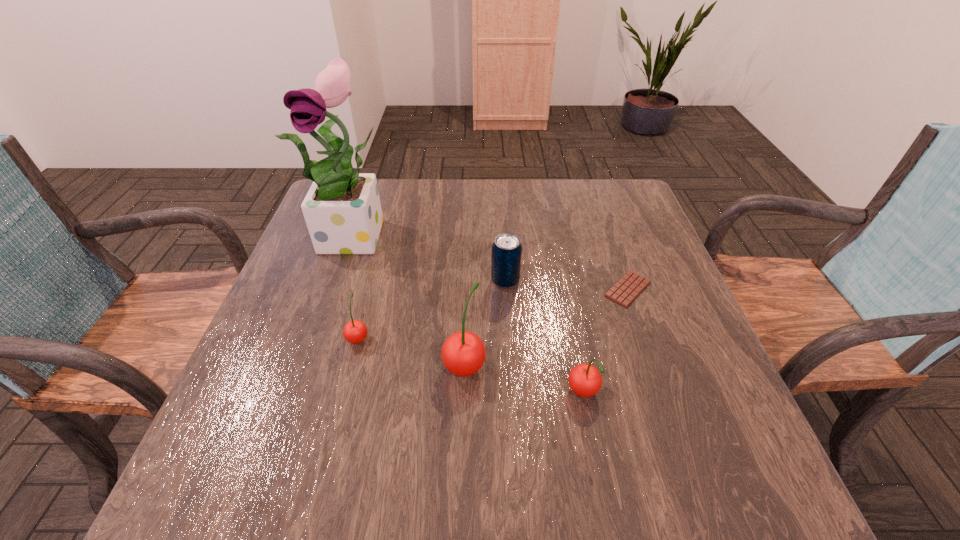
Where is `the rightmost object`? the rightmost object is located at coordinates (624, 292).

Identify the location of vacant space located 0.130m on the left of the second shortest object. This screenshot has height=540, width=960. (284, 338).

Find the location of `vacant space positioned on the right of the fourth object from right to left`. vacant space positioned on the right of the fourth object from right to left is located at coordinates tap(680, 364).

At what (x,y) coordinates should I click in order to perform the action: click on vacant space situated on the back of the second tallest cherry. Please return your answer as a coordinate pair (x, y). The height and width of the screenshot is (540, 960). Looking at the image, I should click on (575, 352).

Where is `vacant space situated on the right of the fourth object from left to right`? The height and width of the screenshot is (540, 960). vacant space situated on the right of the fourth object from left to right is located at coordinates (638, 281).

Find the location of `vacant region located on the front-facing side of the farthest object`. vacant region located on the front-facing side of the farthest object is located at coordinates (326, 334).

The width and height of the screenshot is (960, 540). Identify the location of free space located on the left of the candy bar. (581, 289).

Locate an element on the screen. object at the far edge is located at coordinates (342, 209).

Where is `object situated at the near edge`? The width and height of the screenshot is (960, 540). object situated at the near edge is located at coordinates (585, 380).

Identify the location of object at the left edge. (342, 209).